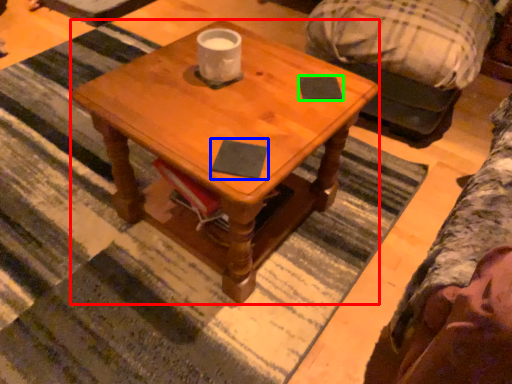
Question: Which object is the farthest from coffee table (highlighted by a red box)? Choose among these: notepad (highlighted by a blue box) or notepad (highlighted by a green box).

Choices:
 (A) notepad
 (B) notepad

Answer: (B)